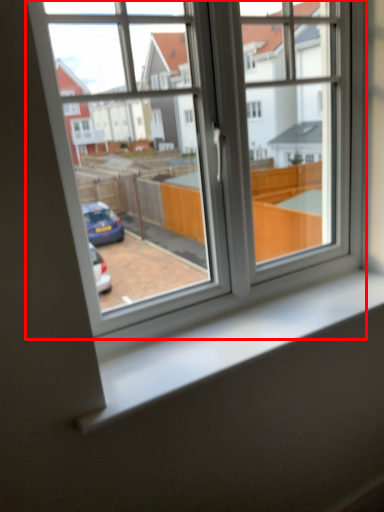
Question: Considering the relative positions of window (annotated by the red box) and window sill in the image provided, where is window (annotated by the red box) located with respect to the staircase?

Choices:
 (A) right
 (B) left

Answer: (B)